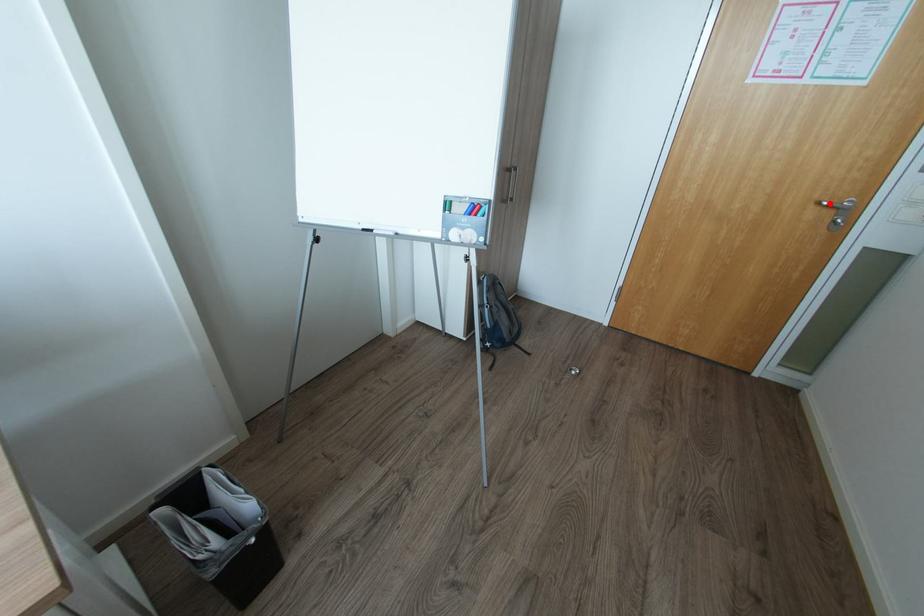
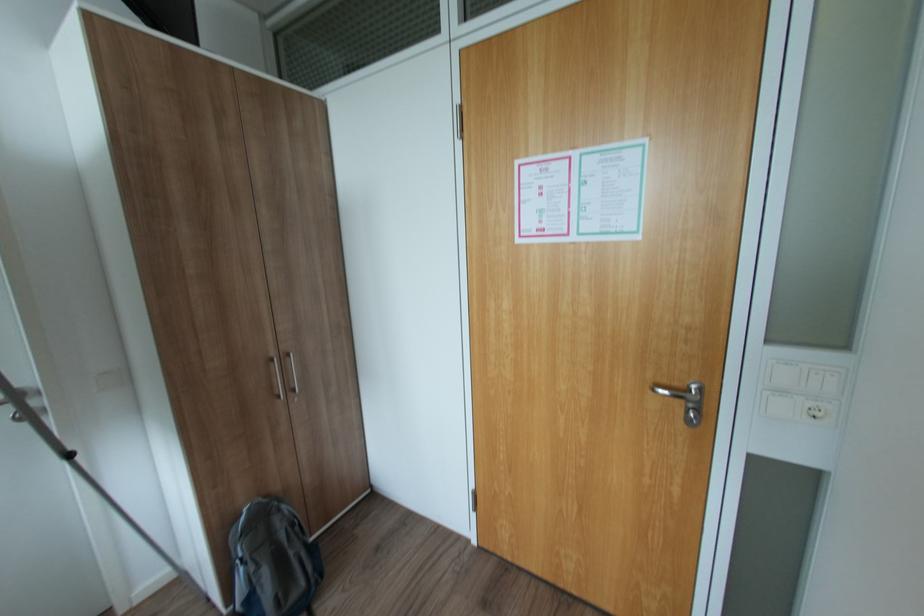
Question: I am providing you with two images of the same scene from different viewpoints. A red point is shown in image1. For the corresponding object point in image2, is it positioned nearer or farther from the camera?

Choices:
 (A) Nearer
 (B) Farther

Answer: (A)